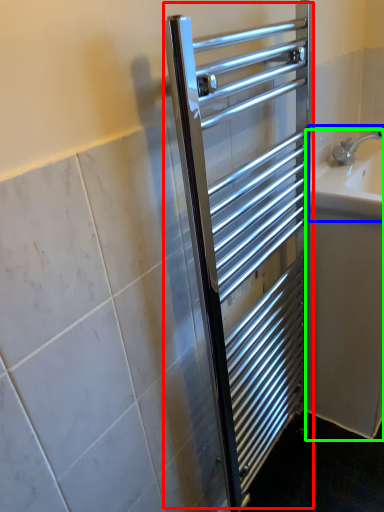
Question: Which is nearer to the screen door (highlighted by a red box)? sink (highlighted by a blue box) or bath (highlighted by a green box).

Choices:
 (A) sink
 (B) bath

Answer: (B)